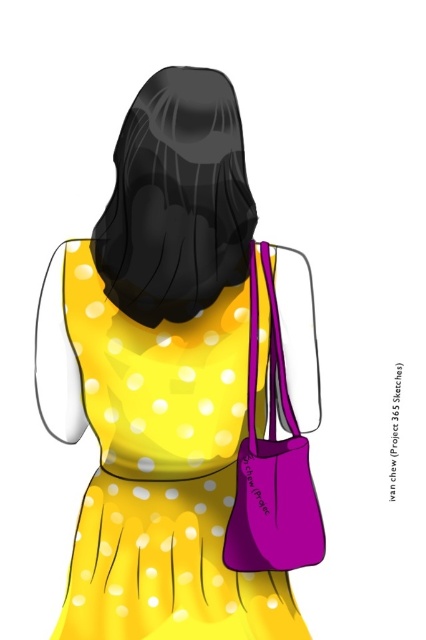
Question: Which point appears farthest from the camera in this image?

Choices:
 (A) (219, 273)
 (B) (284, 371)

Answer: (B)

Question: Is matte purple bag at lower right closer to camera compared to purple matte bag at right?

Choices:
 (A) yes
 (B) no

Answer: (B)

Question: Does matte purple bag at lower right appear over purple matte bag at right?

Choices:
 (A) yes
 (B) no

Answer: (A)

Question: Is matte purple bag at lower right thinner than purple matte bag at right?

Choices:
 (A) yes
 (B) no

Answer: (B)